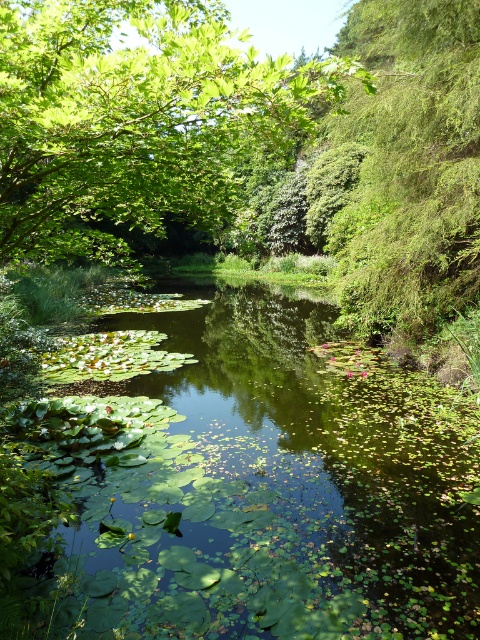
Between point (389, 444) and point (444, 74), which one is positioned behind?

The point (444, 74) is behind.

Is green leafy river at center to the left of green fuzzy bush at right from the viewer's perspective?

Yes, green leafy river at center is to the left of green fuzzy bush at right.

What do you see at coordinates (266, 486) in the screenshot? I see `green leafy river at center` at bounding box center [266, 486].

In order to click on green leafy river at center in this screenshot , I will do `click(266, 486)`.

Which is behind, point (153, 506) or point (249, 61)?

Point (153, 506)

Who is taller, green leafy river at center or green leafy tree at upper left?

Standing taller between the two is green leafy tree at upper left.

Find the location of a particular element. green leafy river at center is located at coordinates (266, 486).

This screenshot has height=640, width=480. What are the coordinates of `green leafy river at center` in the screenshot? It's located at (266, 486).

Consider the image. Is green leafy tree at upper left positioned behind green fuzzy bush at right?

No.

The height and width of the screenshot is (640, 480). Find the location of `green leafy tree at upper left`. green leafy tree at upper left is located at coordinates (139, 120).